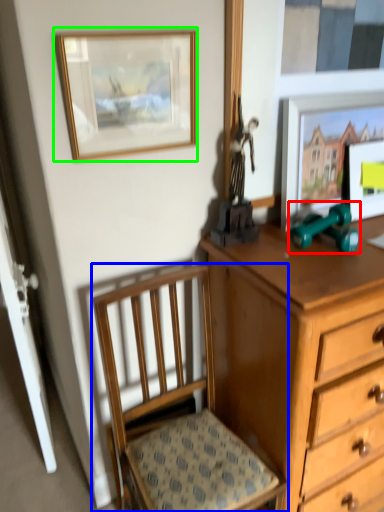
Question: Which is farther away from toy (highlighted by a red box)? chair (highlighted by a blue box) or picture frame (highlighted by a green box)?

Choices:
 (A) chair
 (B) picture frame

Answer: (A)